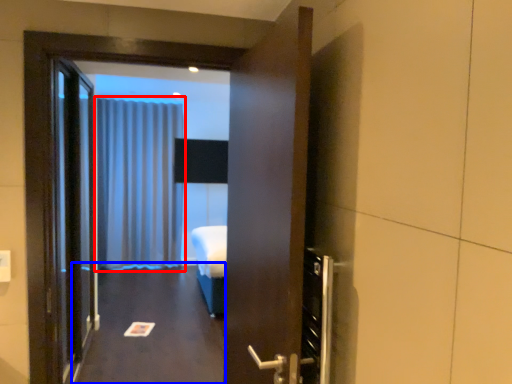
Question: Which object appears closest to the camera in this image, curtain (highlighted by a red box) or corridor (highlighted by a blue box)?

Choices:
 (A) curtain
 (B) corridor

Answer: (B)